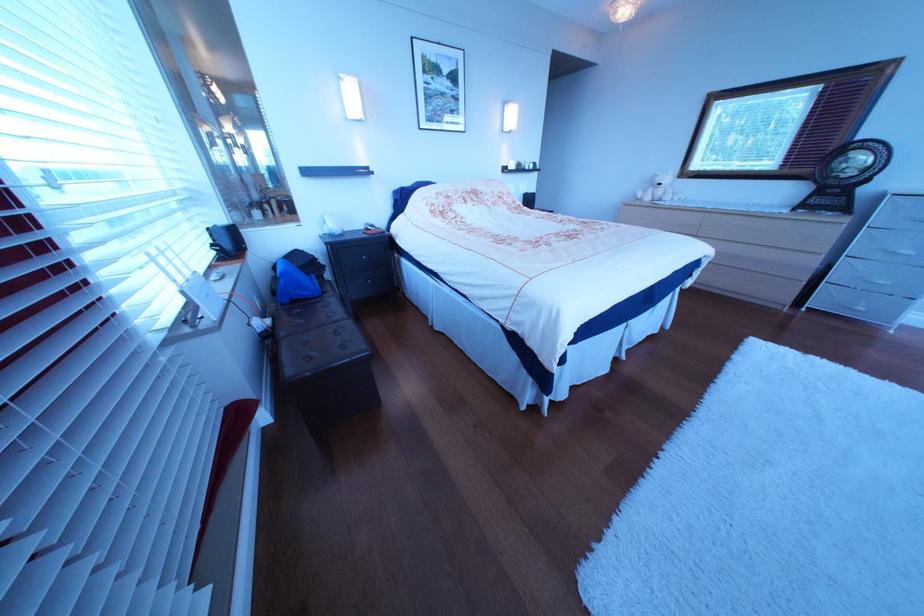
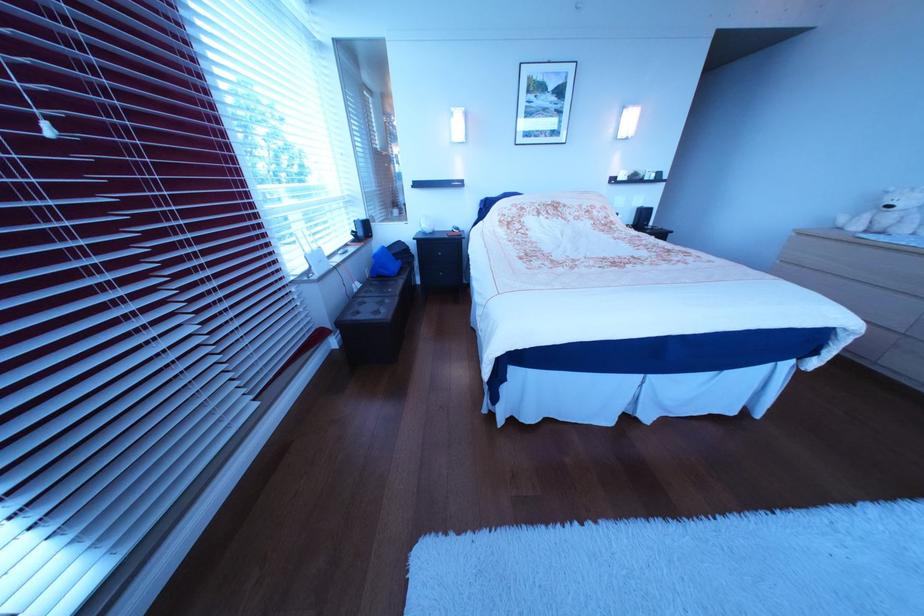
Where in the second image is the point corresponding to point (675, 187) from the first image?

(906, 209)